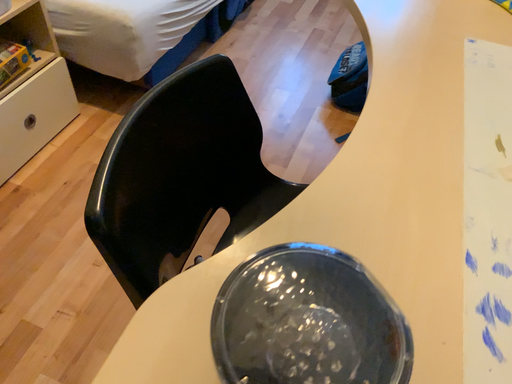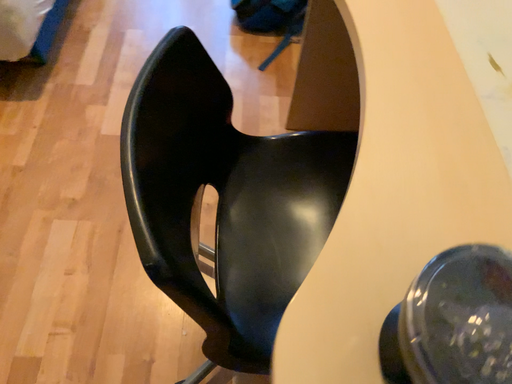
Question: How did the camera likely rotate when shooting the video?

Choices:
 (A) rotated downward
 (B) rotated upward

Answer: (A)